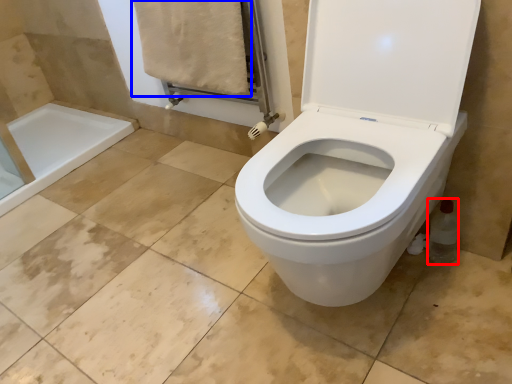
Question: Which object appears farthest to the camera in this image, bottle (highlighted by a red box) or bath towel (highlighted by a blue box)?

Choices:
 (A) bottle
 (B) bath towel

Answer: (B)